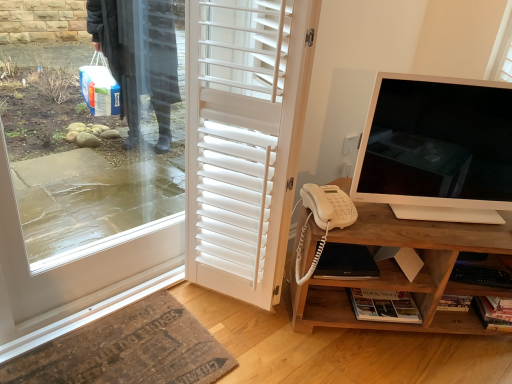
Question: From a real-world perspective, is rug at lower left beneath black matte laptop at lower center?

Choices:
 (A) no
 (B) yes

Answer: (B)

Question: Does rug at lower left have a lesser height compared to black matte laptop at lower center?

Choices:
 (A) no
 (B) yes

Answer: (B)

Question: Can you confirm if rug at lower left is smaller than black matte laptop at lower center?

Choices:
 (A) no
 (B) yes

Answer: (A)

Question: From the image's perspective, is rug at lower left above black matte laptop at lower center?

Choices:
 (A) no
 (B) yes

Answer: (A)

Question: Can you confirm if rug at lower left is thinner than black matte laptop at lower center?

Choices:
 (A) yes
 (B) no

Answer: (B)

Question: From the image's perspective, is white glossy monitor at right above or below rug at lower left?

Choices:
 (A) below
 (B) above

Answer: (B)

Question: Is white glossy monitor at right wider or thinner than rug at lower left?

Choices:
 (A) wide
 (B) thin

Answer: (B)

Question: Is white glossy monitor at right in front of or behind rug at lower left in the image?

Choices:
 (A) behind
 (B) front

Answer: (A)

Question: Based on their positions, is white glossy monitor at right located to the left or right of rug at lower left?

Choices:
 (A) left
 (B) right

Answer: (B)

Question: Considering the positions of point (381, 324) and point (269, 157), is point (381, 324) closer or farther from the camera than point (269, 157)?

Choices:
 (A) farther
 (B) closer

Answer: (A)

Question: Considering the positions of wooden cabinet at right and white matte door at center in the image, is wooden cabinet at right taller or shorter than white matte door at center?

Choices:
 (A) short
 (B) tall

Answer: (A)

Question: From a real-world perspective, is wooden cabinet at right above or below white matte door at center?

Choices:
 (A) above
 (B) below

Answer: (B)

Question: Would you say wooden cabinet at right is to the left or to the right of white matte door at center in the picture?

Choices:
 (A) right
 (B) left

Answer: (A)

Question: In terms of height, does white glossy monitor at right look taller or shorter compared to black matte laptop at lower center?

Choices:
 (A) short
 (B) tall

Answer: (B)

Question: Based on their sizes in the image, would you say white glossy monitor at right is bigger or smaller than black matte laptop at lower center?

Choices:
 (A) big
 (B) small

Answer: (A)